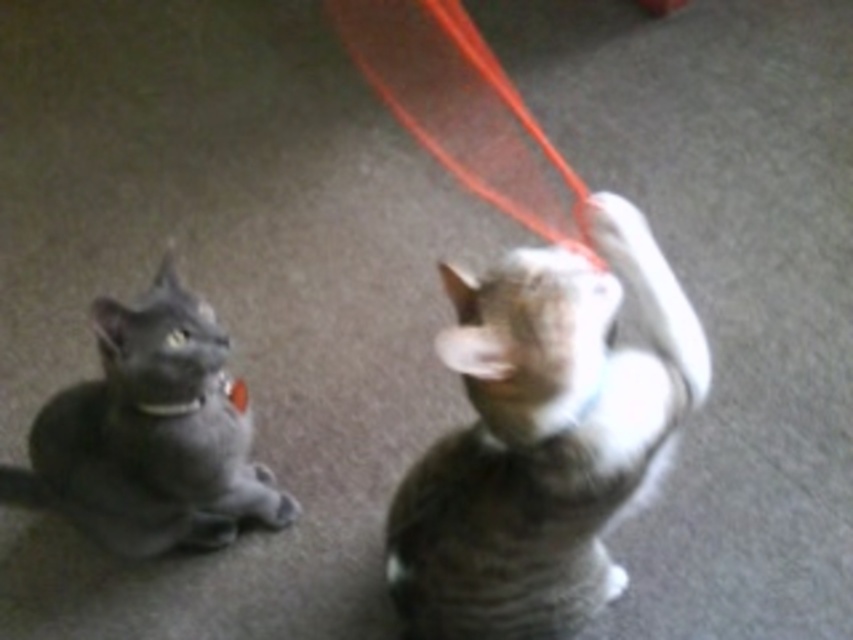
Is point (637, 272) behind point (32, 499)?

No, it is not.

Between point (401, 605) and point (173, 298), which one is positioned in front?

Point (173, 298) is more forward.

Where is `striped fur cat at center`? striped fur cat at center is located at coordinates (543, 436).

Can you confirm if striped fur cat at center is positioned below red string at upper center?

Yes.

Does striped fur cat at center have a larger size compared to red string at upper center?

Correct, striped fur cat at center is larger in size than red string at upper center.

The width and height of the screenshot is (853, 640). I want to click on striped fur cat at center, so click(543, 436).

Between matte gray cat at left and red string at upper center, which one is positioned higher?

Positioned higher is red string at upper center.

Between point (165, 332) and point (424, 147), which one is positioned behind?

Point (424, 147)

This screenshot has width=853, height=640. What are the coordinates of `matte gray cat at left` in the screenshot? It's located at (152, 433).